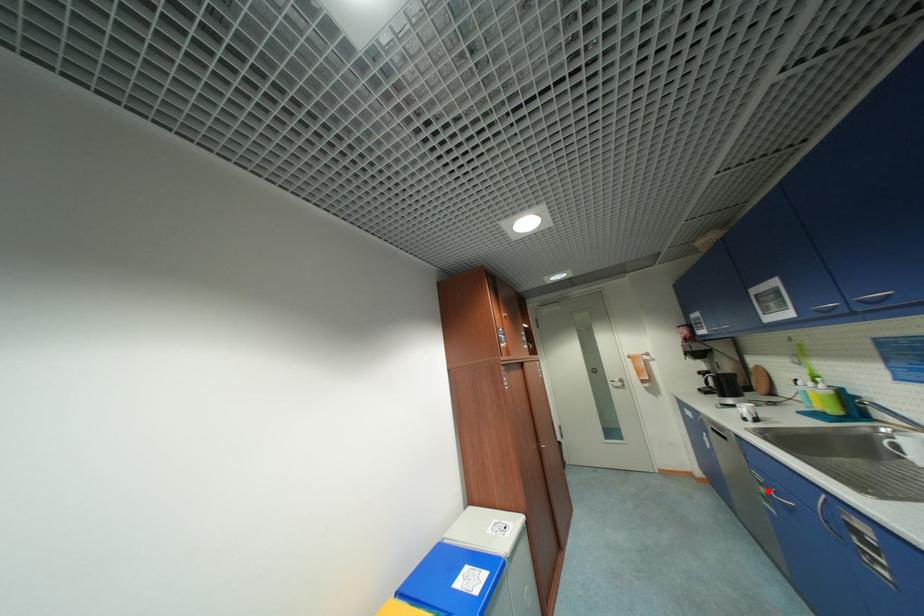
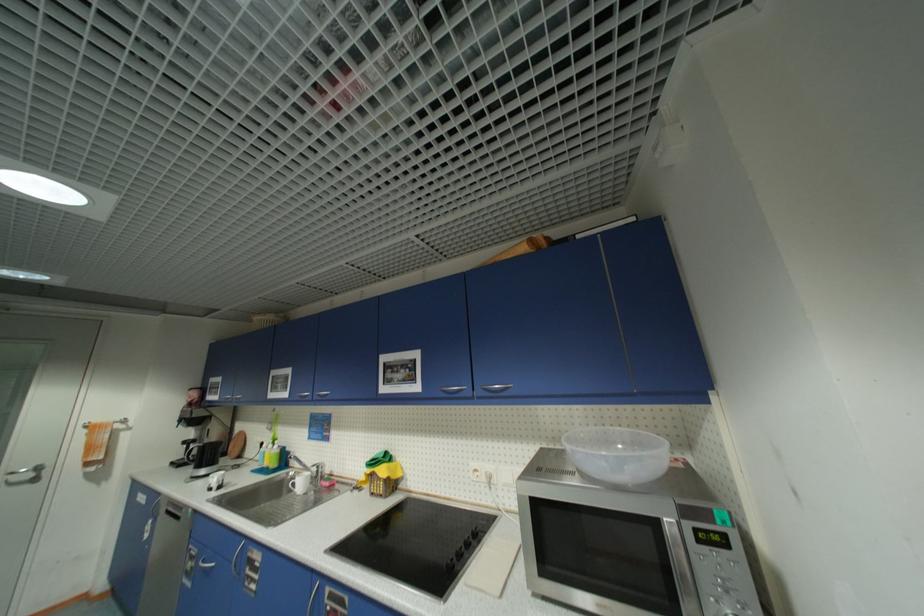
Find the pixel in the second image that matches the highlighted location in the first image.

(196, 565)